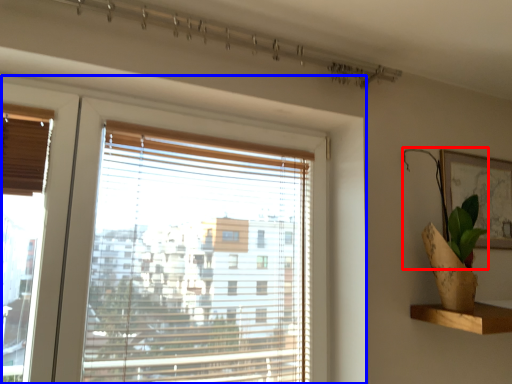
Question: Which of the following is the closest to the observer, plant (highlighted by a red box) or window (highlighted by a blue box)?

Choices:
 (A) plant
 (B) window

Answer: (B)